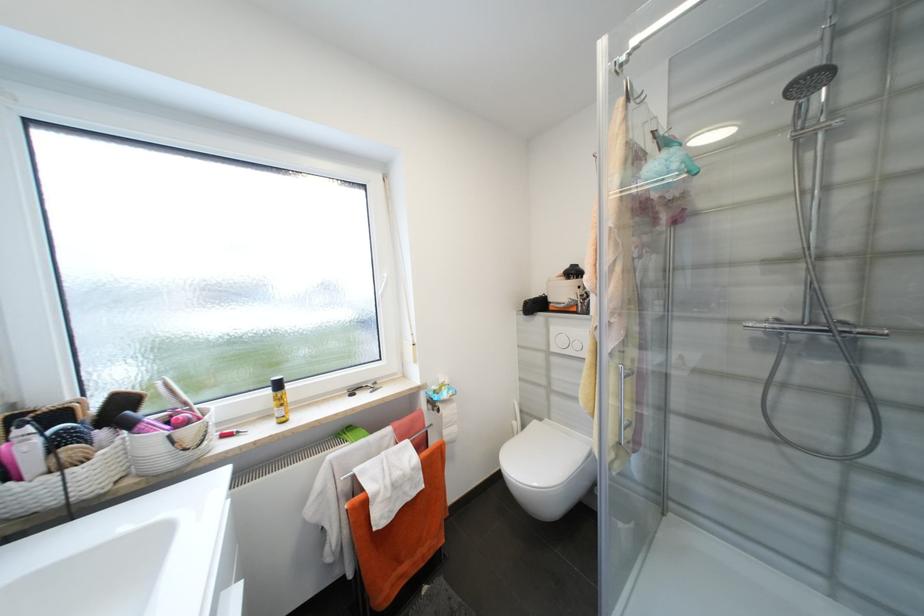
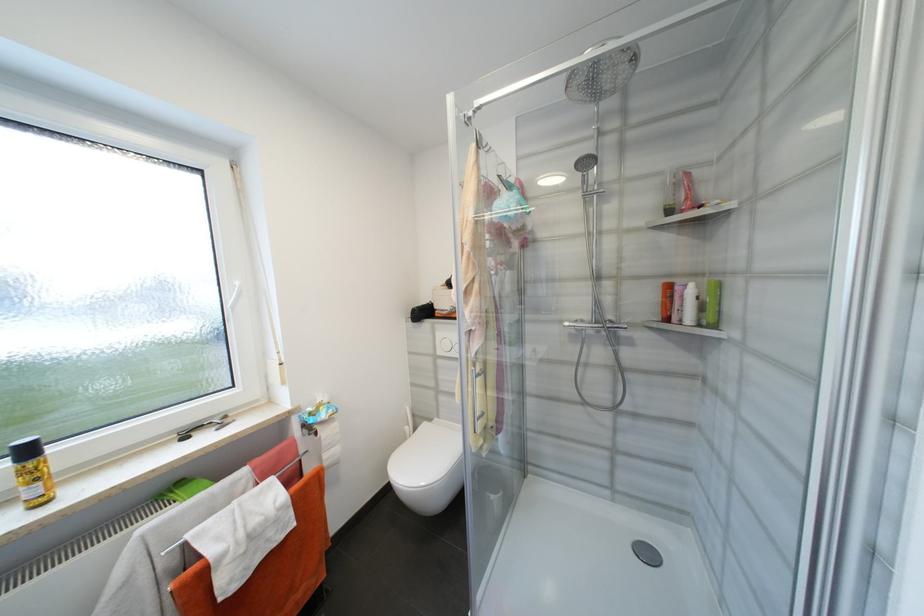
Locate, in the second image, the point that corresponds to point (756, 325) in the first image.

(573, 325)